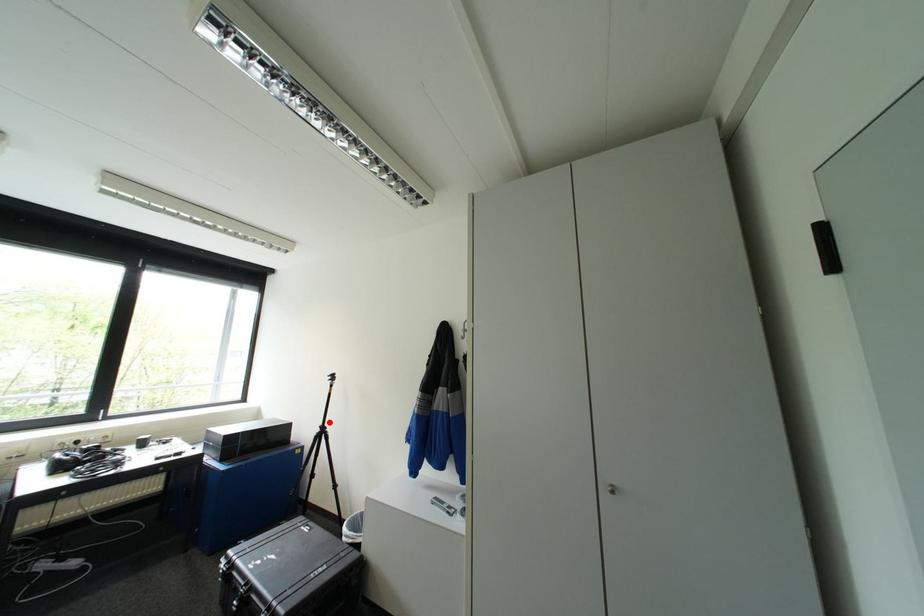
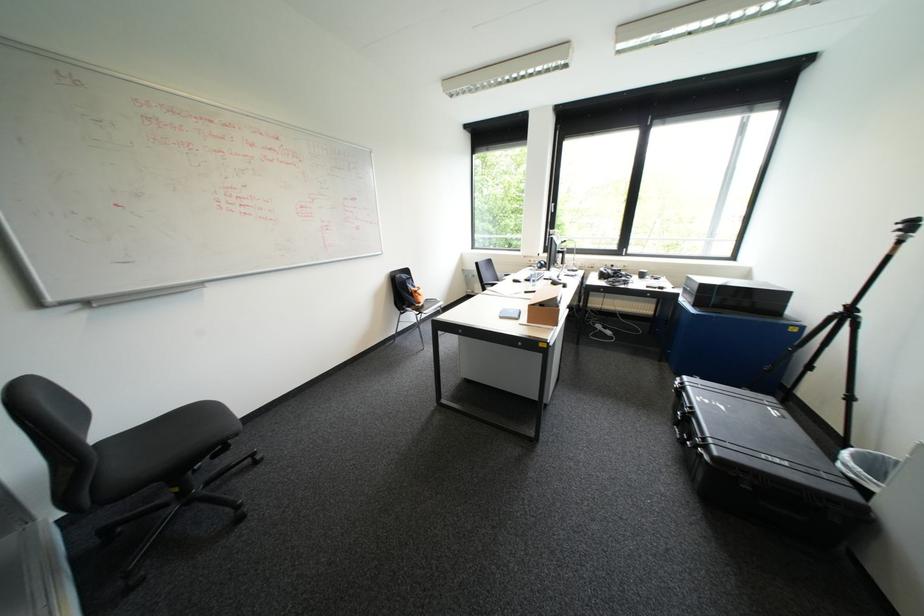
Locate, in the second image, the point that corresponds to the highlighted location in the first image.

(857, 301)